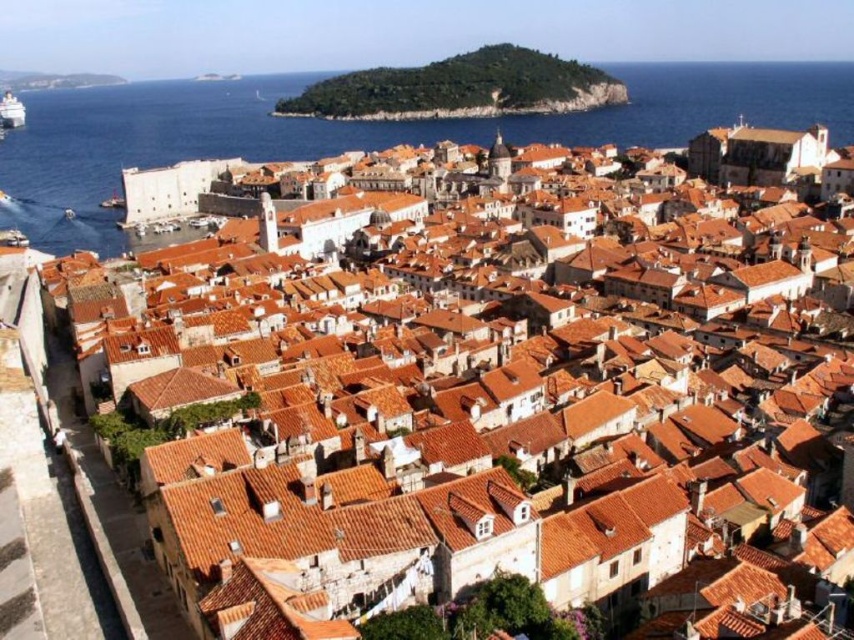
Looking at the historic coastal city scene, there is a green leafy hillside at upper center and a white plastic boat at upper left. Which of these two objects is positioned to the right of the other?

The green leafy hillside at upper center is positioned to the right of the white plastic boat at upper left.

You are standing on a viewing platform overlooking the city. You notice the blue water at lower left and the green leafy hillside at upper center in your view. Which of these two landmarks is positioned higher up in the scene?

The green leafy hillside at upper center is positioned higher up in the scene than the blue water at lower left.

From the picture: You are a tourist standing on the ancient stone walls of the city, looking towards the blue water at lower left and the white plastic boat at upper left. Which object is located to the right of the other?

The blue water at lower left is positioned on the right side of the white plastic boat at upper left.